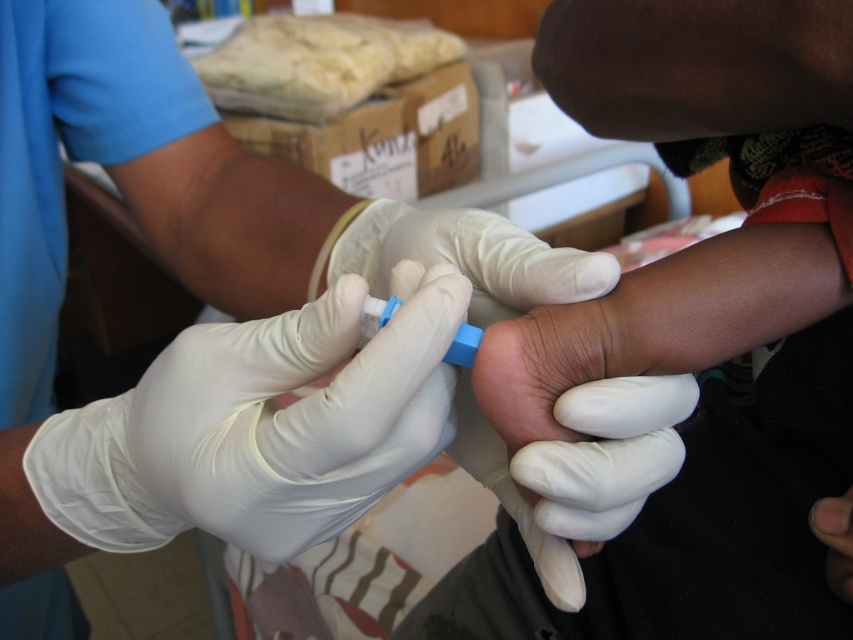
This screenshot has height=640, width=853. I want to click on white latex gloves at center, so click(190, 330).

Can you confirm if white latex gloves at center is taller than blue plastic syringe at center?

Indeed, white latex gloves at center has a greater height compared to blue plastic syringe at center.

Is point (374, 394) more distant than point (363, 328)?

No, it is not.

Locate an element on the screen. The image size is (853, 640). white latex gloves at center is located at coordinates (190, 330).

Is white latex gloves at center further to the viewer compared to white rubber glove at center?

No.

Which is above, white latex gloves at center or white rubber glove at center?

Positioned higher is white rubber glove at center.

Which is in front, point (148, 88) or point (502, 468)?

Point (502, 468)

This screenshot has width=853, height=640. Find the location of `white latex gloves at center`. white latex gloves at center is located at coordinates [190, 330].

Looking at this image, is white latex gloves at center above white latex glove at center?

Yes.

Does point (222, 147) come closer to viewer compared to point (302, 326)?

No, it is behind (302, 326).

Locate an element on the screen. white latex gloves at center is located at coordinates (190, 330).